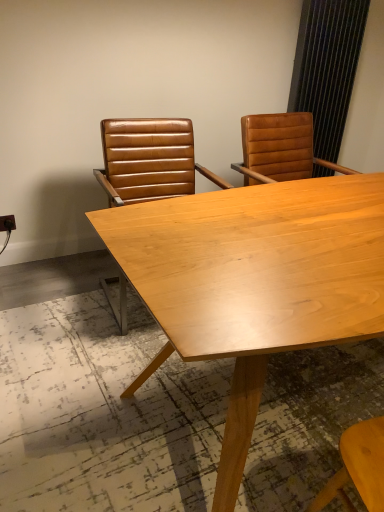
Question: Is black textured curtain at upper right touching brown leather chair at upper right, arranged as the second chair when viewed from the left?

Choices:
 (A) yes
 (B) no

Answer: (B)

Question: Considering the relative sizes of black textured curtain at upper right and brown leather chair at upper right, arranged as the second chair when viewed from the left, in the image provided, is black textured curtain at upper right wider than brown leather chair at upper right, arranged as the second chair when viewed from the left,?

Choices:
 (A) no
 (B) yes

Answer: (A)

Question: Is black textured curtain at upper right positioned in front of brown leather chair at upper right, which appears as the first chair when viewed from the right?

Choices:
 (A) no
 (B) yes

Answer: (A)

Question: Is black textured curtain at upper right positioned with its back to brown leather chair at upper right, arranged as the second chair when viewed from the left?

Choices:
 (A) yes
 (B) no

Answer: (B)

Question: Is black textured curtain at upper right smaller than brown leather chair at upper right, which appears as the first chair when viewed from the right?

Choices:
 (A) yes
 (B) no

Answer: (A)

Question: Is black textured curtain at upper right to the right of brown leather chair at upper right, arranged as the second chair when viewed from the left, from the viewer's perspective?

Choices:
 (A) no
 (B) yes

Answer: (B)

Question: Considering the relative sizes of brown leather chair at upper right, arranged as the second chair when viewed from the left, and brown leather chair at center, the second chair when ordered from right to left, in the image provided, is brown leather chair at upper right, arranged as the second chair when viewed from the left, shorter than brown leather chair at center, the second chair when ordered from right to left,?

Choices:
 (A) yes
 (B) no

Answer: (A)

Question: Can you confirm if brown leather chair at upper right, which appears as the first chair when viewed from the right, is smaller than brown leather chair at center, the second chair when ordered from right to left?

Choices:
 (A) no
 (B) yes

Answer: (B)

Question: Is brown leather chair at upper right, arranged as the second chair when viewed from the left, not near brown leather chair at center, the 1th chair in the left-to-right sequence?

Choices:
 (A) no
 (B) yes

Answer: (A)

Question: From a real-world perspective, does brown leather chair at upper right, which appears as the first chair when viewed from the right, stand above brown leather chair at center, the 1th chair in the left-to-right sequence?

Choices:
 (A) yes
 (B) no

Answer: (A)

Question: Is brown leather chair at upper right, which appears as the first chair when viewed from the right, facing away from brown leather chair at center, the second chair when ordered from right to left?

Choices:
 (A) yes
 (B) no

Answer: (B)

Question: Considering the relative positions of brown leather chair at upper right, which appears as the first chair when viewed from the right, and brown leather chair at center, the second chair when ordered from right to left, in the image provided, is brown leather chair at upper right, which appears as the first chair when viewed from the right, to the left of brown leather chair at center, the second chair when ordered from right to left, from the viewer's perspective?

Choices:
 (A) no
 (B) yes

Answer: (A)

Question: Are light wood table at center and black textured curtain at upper right located far from each other?

Choices:
 (A) yes
 (B) no

Answer: (A)